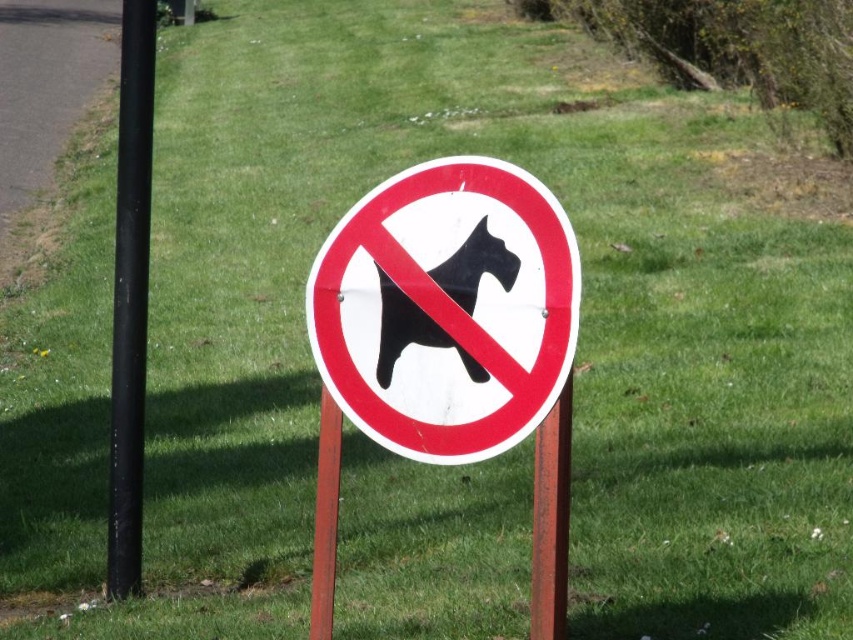
Can you confirm if white plastic sign at center is smaller than brown wooden post at center?

Incorrect, white plastic sign at center is not smaller in size than brown wooden post at center.

This screenshot has height=640, width=853. Describe the element at coordinates (447, 308) in the screenshot. I see `white plastic sign at center` at that location.

Locate an element on the screen. The height and width of the screenshot is (640, 853). white plastic sign at center is located at coordinates (447, 308).

Does white plastic sign at center have a lesser height compared to black matte dog at center?

In fact, white plastic sign at center may be taller than black matte dog at center.

Between white plastic sign at center and black matte dog at center, which one has less height?

Standing shorter between the two is black matte dog at center.

Between point (390, 444) and point (437, 273), which one is positioned in front?

Point (437, 273) is more forward.

This screenshot has height=640, width=853. In order to click on white plastic sign at center in this screenshot , I will do `click(447, 308)`.

Is black matte dog at center thinner than rusty metal post at center?

No.

Between black matte dog at center and rusty metal post at center, which one appears on the right side from the viewer's perspective?

rusty metal post at center

Between point (384, 349) and point (543, 509), which one is positioned in front?

Point (543, 509) is more forward.

At what (x,y) coordinates should I click in order to perform the action: click on black matte dog at center. Please return your answer as a coordinate pair (x, y). Looking at the image, I should click on (412, 330).